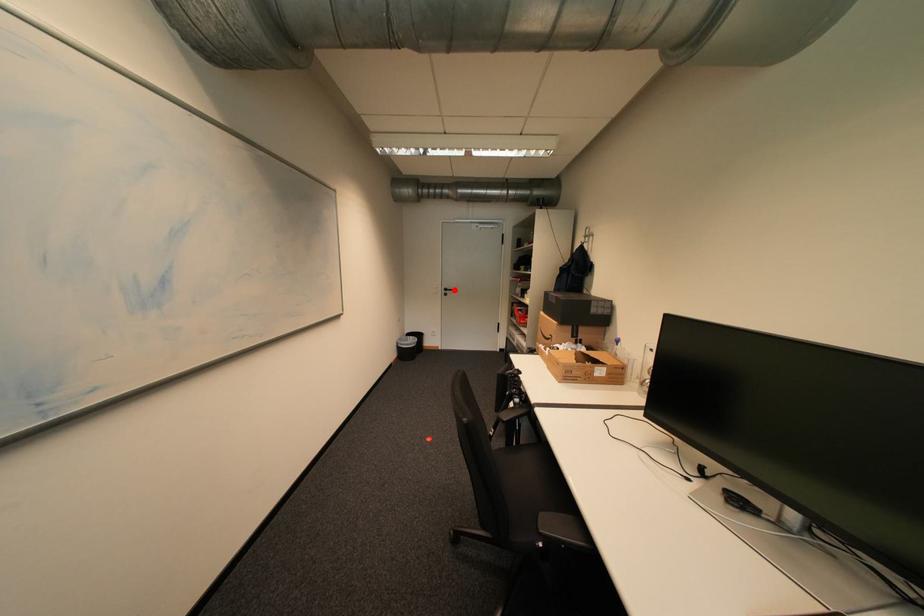
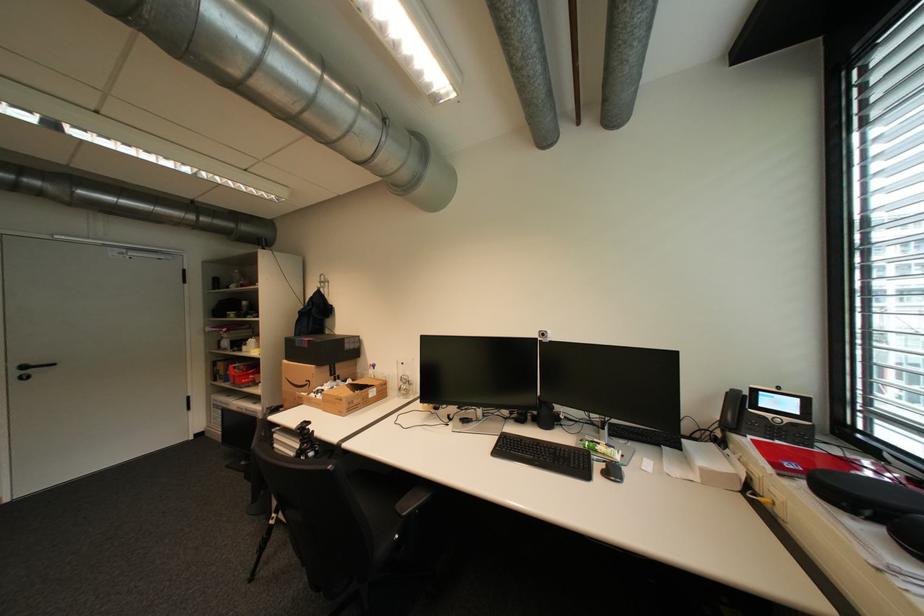
Find the pixel in the second image that matches the highlighted location in the first image.

(32, 368)